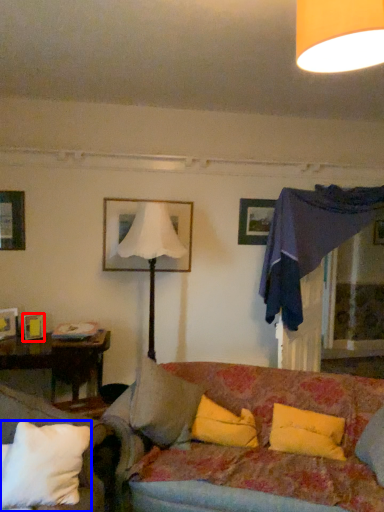
Question: Which of the following is the closest to the observer, picture frame (highlighted by a red box) or pillow (highlighted by a blue box)?

Choices:
 (A) picture frame
 (B) pillow

Answer: (B)